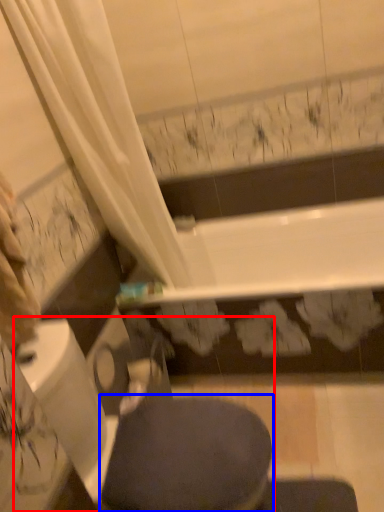
Question: Which of the following is the farthest to the observer, swivel chair (highlighted by a red box) or bidet (highlighted by a blue box)?

Choices:
 (A) swivel chair
 (B) bidet

Answer: (B)